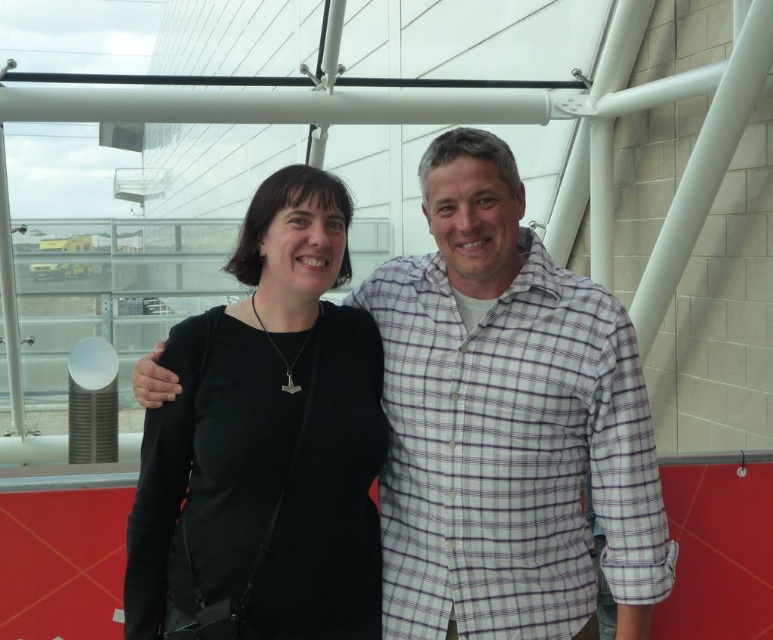
Is point (450, 515) positioned in front of point (322, 513)?

That is False.

Between white checkered shirt at center and black matte/black fabric at center, which one appears on the right side from the viewer's perspective?

white checkered shirt at center is more to the right.

Is point (506, 432) positioned in front of point (145, 429)?

Yes, point (506, 432) is in front of point (145, 429).

Where is `white checkered shirt at center`? Image resolution: width=773 pixels, height=640 pixels. white checkered shirt at center is located at coordinates (506, 424).